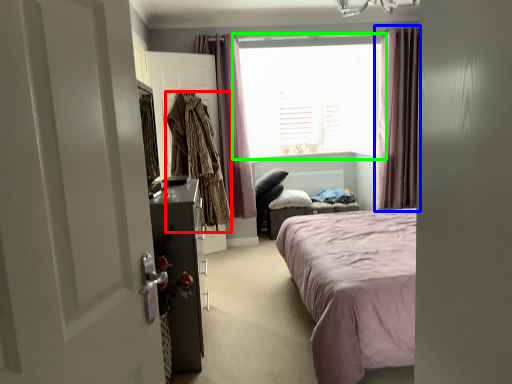
Question: Considering the real-world distances, which object is closest to clothing (highlighted by a red box)? curtain (highlighted by a blue box) or window (highlighted by a green box).

Choices:
 (A) curtain
 (B) window

Answer: (B)